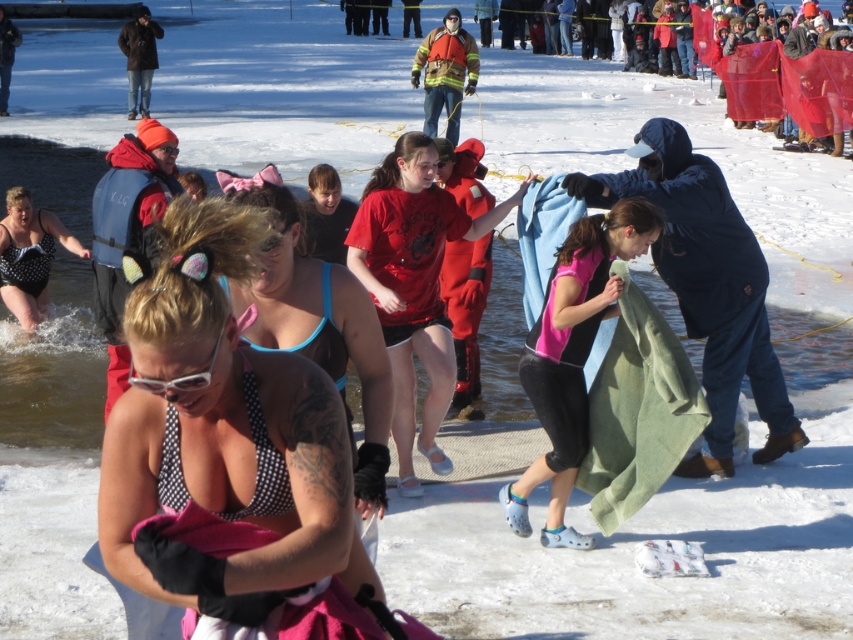
Is red cotton shirt at center taller than pink fleece blanket at center?

Yes, red cotton shirt at center is taller than pink fleece blanket at center.

What do you see at coordinates (413, 284) in the screenshot? This screenshot has height=640, width=853. I see `red cotton shirt at center` at bounding box center [413, 284].

Image resolution: width=853 pixels, height=640 pixels. In order to click on red cotton shirt at center in this screenshot , I will do `click(413, 284)`.

Looking at this image, between pink polka dot bikini top at center and polka dot swimsuit at left, which one has less height?

With less height is pink polka dot bikini top at center.

This screenshot has height=640, width=853. I want to click on pink polka dot bikini top at center, so click(224, 422).

At what (x,y) coordinates should I click in order to perform the action: click on pink polka dot bikini top at center. Please return your answer as a coordinate pair (x, y). The height and width of the screenshot is (640, 853). Looking at the image, I should click on (224, 422).

Which is above, red cotton shirt at center or blue bikini top at center?

blue bikini top at center is above.

Does red cotton shirt at center have a larger size compared to blue bikini top at center?

Actually, red cotton shirt at center might be smaller than blue bikini top at center.

Which is behind, point (418, 204) or point (285, 243)?

The point (418, 204) is more distant.

Where is `red cotton shirt at center`? This screenshot has height=640, width=853. red cotton shirt at center is located at coordinates (413, 284).